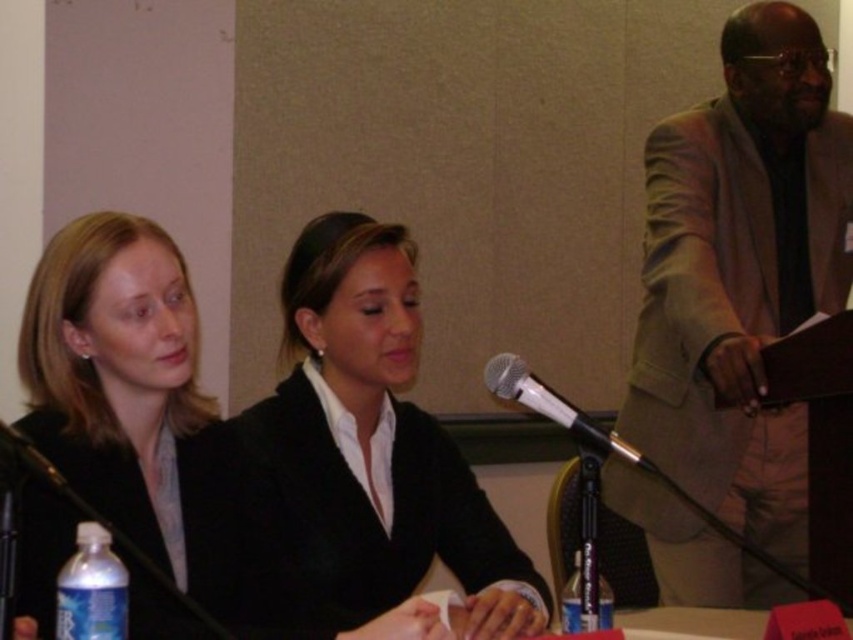
Is black matte blazer at center bigger than clear plastic bottle at lower left?

Correct, black matte blazer at center is larger in size than clear plastic bottle at lower left.

Who is lower down, black matte blazer at center or clear plastic bottle at lower left?

clear plastic bottle at lower left

Does point (404, 557) come closer to viewer compared to point (74, 627)?

No, it is behind (74, 627).

At what (x,y) coordinates should I click in order to perform the action: click on black matte blazer at center. Please return your answer as a coordinate pair (x, y). Looking at the image, I should click on (370, 449).

From the picture: Can you confirm if silver metallic microphone at center is positioned to the right of black matte business suit at left?

Indeed, silver metallic microphone at center is positioned on the right side of black matte business suit at left.

This screenshot has height=640, width=853. I want to click on silver metallic microphone at center, so click(x=556, y=410).

Does point (496, 387) come closer to viewer compared to point (33, 449)?

No, it is behind (33, 449).

Where is `silver metallic microphone at center`? silver metallic microphone at center is located at coordinates (556, 410).

Can you confirm if clear plastic bottle at lower left is taller than clear plastic bottle at lower center?

No, clear plastic bottle at lower left is not taller than clear plastic bottle at lower center.

Which is above, clear plastic bottle at lower left or clear plastic bottle at lower center?

clear plastic bottle at lower left is higher up.

Which is behind, point (97, 596) or point (573, 611)?

The point (573, 611) is more distant.

The image size is (853, 640). I want to click on clear plastic bottle at lower left, so pyautogui.click(x=91, y=588).